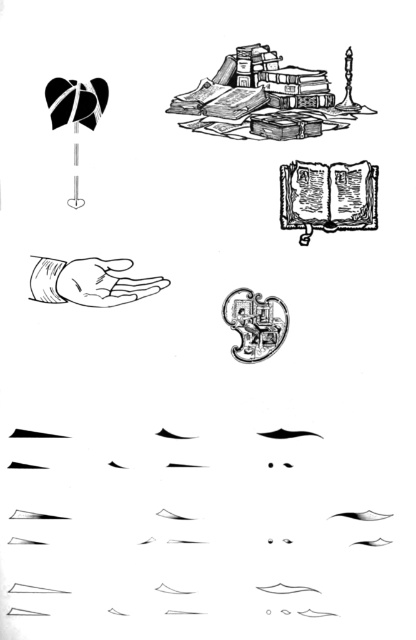
Question: Which object is farther from the camera taking this photo?

Choices:
 (A) smooth skin hand at center
 (B) stacked books at upper center
 (C) open book at upper right
 (D) shiny metallic key at center

Answer: (D)

Question: Is open book at upper right wider than shiny metallic key at center?

Choices:
 (A) no
 (B) yes

Answer: (B)

Question: Among these objects, which one is farthest from the camera?

Choices:
 (A) smooth skin hand at center
 (B) stacked books at upper center

Answer: (A)

Question: Can you confirm if smooth skin hand at center is positioned to the left of shiny metallic key at center?

Choices:
 (A) yes
 (B) no

Answer: (A)

Question: Which point is closer to the camera?

Choices:
 (A) (227, 104)
 (B) (106, 260)
 (C) (242, 294)

Answer: (A)

Question: Does smooth skin hand at center have a larger size compared to shiny metallic key at center?

Choices:
 (A) no
 (B) yes

Answer: (B)